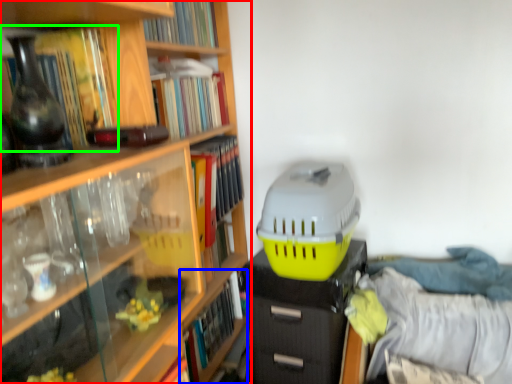
Question: Based on their relative distances, which object is nearer to book (highlighted by a red box)? Choose from book (highlighted by a blue box) and book (highlighted by a green box).

Choices:
 (A) book
 (B) book

Answer: (B)